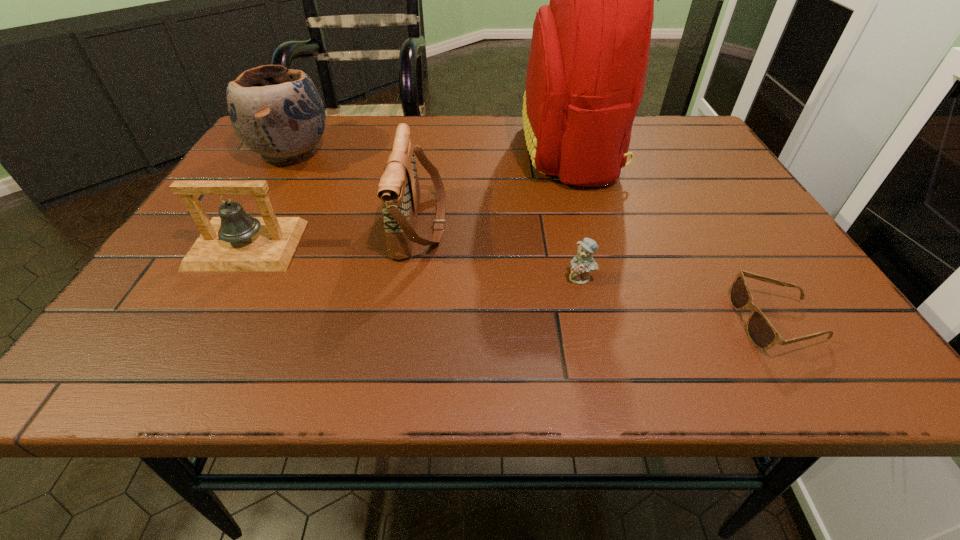
The width and height of the screenshot is (960, 540). I want to click on free space located on the front of the pottery, so click(204, 300).

Identify the location of vacant point located on the front-facing side of the shoulder bag. (538, 224).

You are a GUI agent. You are given a task and a screenshot of the screen. Output one action in this format:
    pyautogui.click(x=<x>, y=<y>)
    Task: Click on the vacant space located on the back of the third shortest object
    
    Given the screenshot: What is the action you would take?
    pyautogui.click(x=311, y=132)

I want to click on vacant space located 0.180m on the front-facing side of the teddy bear, so click(603, 373).

Locate an element on the screen. vacant area situated 0.380m on the frames of the nearest object is located at coordinates (509, 321).

Image resolution: width=960 pixels, height=540 pixels. What are the coordinates of `free spot located 0.120m on the frames of the nearest object` in the screenshot? It's located at (667, 321).

The image size is (960, 540). I want to click on vacant space located 0.220m on the frames of the nearest object, so click(606, 321).

Identify the location of backpack located at the far edge. (589, 55).

Identify the location of pottery at the far edge. The height and width of the screenshot is (540, 960). (276, 112).

Locate an element on the screen. object that is at the near edge is located at coordinates (763, 335).